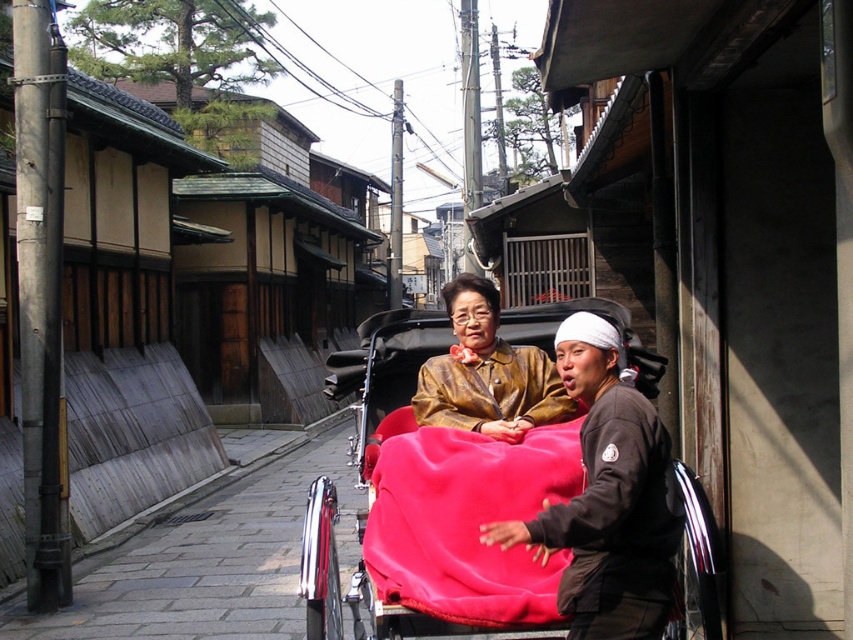
Question: Is velvet red cart at center in front of brown leather coach at center?

Choices:
 (A) no
 (B) yes

Answer: (A)

Question: Is velvet red cart at center closer to camera compared to brown leather coach at center?

Choices:
 (A) yes
 (B) no

Answer: (B)

Question: Which point is closer to the camera?

Choices:
 (A) (491, 369)
 (B) (654, 627)
 (C) (631, 364)

Answer: (B)

Question: Which of these objects is positioned closest to the bronze textured jacket at center?

Choices:
 (A) velvet-like red blanket at center
 (B) brown leather coach at center

Answer: (A)

Question: Which point is farther to the camera?

Choices:
 (A) velvet red cart at center
 (B) brown leather coach at center

Answer: (A)

Question: Does brown leather coach at center appear under bronze textured jacket at center?

Choices:
 (A) yes
 (B) no

Answer: (A)